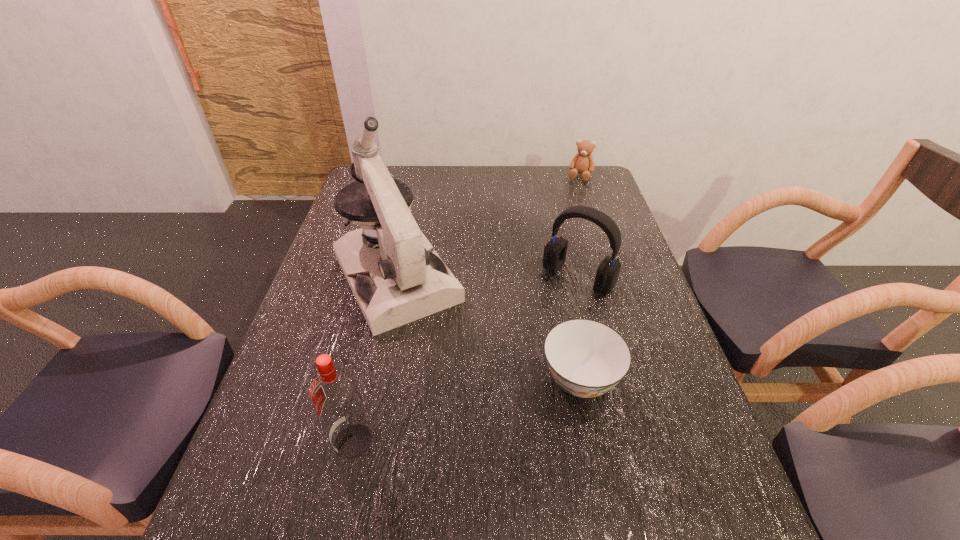
The width and height of the screenshot is (960, 540). In order to click on free area in between the headset and the vodka in this screenshot , I will do `click(466, 360)`.

In order to click on unoccupied position between the fourth shortest object and the fourth farthest object in this screenshot , I will do `click(467, 410)`.

Locate which object is the third closest to the shortest object. Please provide its 2D coordinates. Your answer should be formatted as a tuple, i.e. [(x, y)], where the tuple contains the x and y coordinates of a point satisfying the conditions above.

[(334, 393)]

Locate which object is the closest to the second tallest object. Please provide its 2D coordinates. Your answer should be formatted as a tuple, i.e. [(x, y)], where the tuple contains the x and y coordinates of a point satisfying the conditions above.

[(403, 280)]